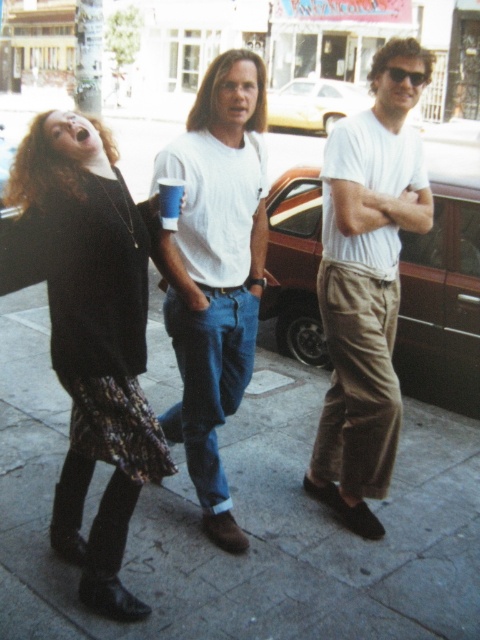
Based on the photo, is smooth concrete sidewalk at center taller than white cotton t-shirt at center?

No.

Is smooth concrete sidewalk at center smaller than white cotton t-shirt at center?

Actually, smooth concrete sidewalk at center might be larger than white cotton t-shirt at center.

Between point (278, 410) and point (339, 132), which one is positioned in front?

Positioned in front is point (339, 132).

I want to click on smooth concrete sidewalk at center, so 244,518.

Measure the distance between black knit sweater at left and blue paper cup at center.

black knit sweater at left and blue paper cup at center are 21.33 inches apart.

Can you confirm if black knit sweater at left is smaller than blue paper cup at center?

Actually, black knit sweater at left might be larger than blue paper cup at center.

At what (x,y) coordinates should I click in order to perform the action: click on black knit sweater at left. Please return your answer as a coordinate pair (x, y). The width and height of the screenshot is (480, 640). Looking at the image, I should click on (90, 332).

Does point (95, 196) lie behind point (367, 522)?

No, (95, 196) is closer to viewer.

Does black knit sweater at left have a smaller size compared to white cotton t-shirt at center?

Correct, black knit sweater at left occupies less space than white cotton t-shirt at center.

Where is `black knit sweater at left`? The height and width of the screenshot is (640, 480). black knit sweater at left is located at coordinates [x=90, y=332].

Find the location of a particular element. This screenshot has height=640, width=480. black knit sweater at left is located at coordinates (90, 332).